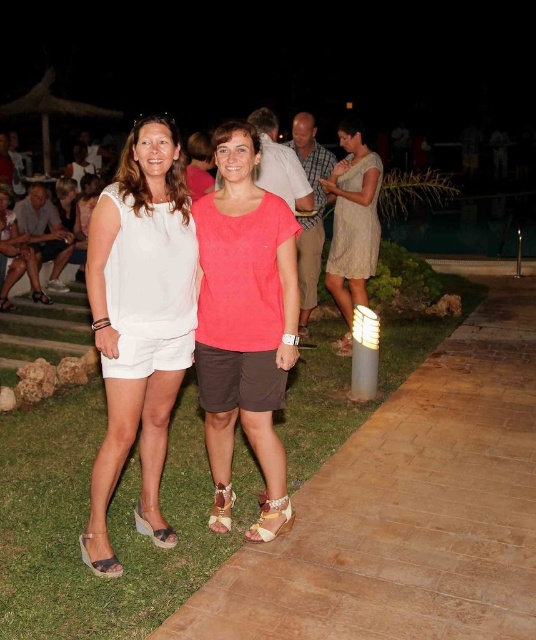
You are a photographer trying to capture a closeup of the white cotton shorts at center and the matte black wedge sandal at lower left. Given that the camera can only focus on objects within a 10cm diameter, will both items fit within the frame?

The white cotton shorts at center is larger in size than matte black wedge sandal at lower left. Since the camera can only focus on objects within a 10cm diameter, the white cotton shorts at center may be too large to fit within the frame, while the matte black wedge sandal at lower left might fit. However, without knowing the exact dimensions of the shorts and sandal, it is difficult to determine for sure.